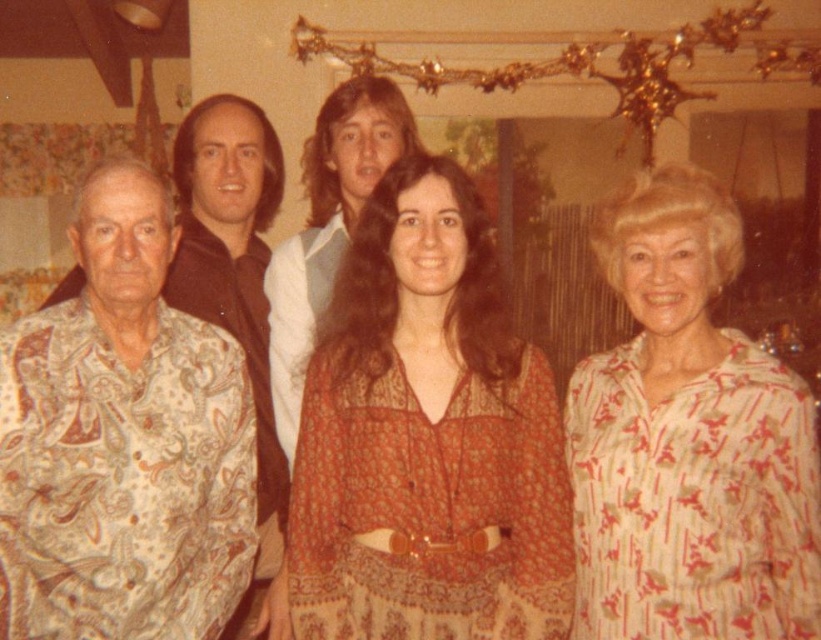
Can you confirm if brown printed dress at center is positioned below patterned fabric shirt at left?

Indeed, brown printed dress at center is positioned under patterned fabric shirt at left.

Is brown printed dress at center closer to the viewer compared to patterned fabric shirt at left?

Yes, it is.

What do you see at coordinates (425, 438) in the screenshot? The height and width of the screenshot is (640, 821). I see `brown printed dress at center` at bounding box center [425, 438].

I want to click on brown printed dress at center, so click(x=425, y=438).

Is point (345, 560) positioned before point (291, 436)?

Yes, it is in front of point (291, 436).

Which is above, brown printed dress at center or white shirt at center?

white shirt at center

Which is in front, point (315, 604) or point (415, 148)?

Positioned in front is point (315, 604).

Identify the location of brown printed dress at center. (425, 438).

Locate an element on the screen. The width and height of the screenshot is (821, 640). white striped dress at right is located at coordinates (688, 440).

Does point (668, 218) lie in front of point (283, 246)?

Yes, point (668, 218) is in front of point (283, 246).

I want to click on white striped dress at right, so click(x=688, y=440).